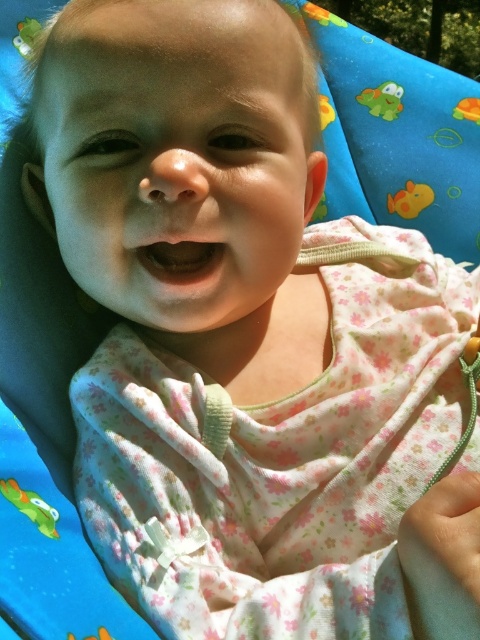
Which of these two, pink fabric mouth at center or yellow rubber duck at upper right, stands taller?

With more height is yellow rubber duck at upper right.

Can you confirm if pink fabric mouth at center is taller than yellow rubber duck at upper right?

No, pink fabric mouth at center is not taller than yellow rubber duck at upper right.

Is point (157, 275) in front of point (428, 200)?

Yes, it is in front of point (428, 200).

Locate an element on the screen. pink fabric mouth at center is located at coordinates (180, 259).

In the scene shown: Does green rubber turtle at upper center come in front of green plastic frog at upper left?

No, it is not.

Who is more distant from viewer, (396, 104) or (26, 33)?

The point (396, 104) is behind.

Who is more distant from viewer, [382,93] or [32,35]?

Positioned behind is point [382,93].

Find the location of a particular element. The height and width of the screenshot is (640, 480). green rubber turtle at upper center is located at coordinates (383, 99).

Find the location of `green rubber turtle at upper center`. green rubber turtle at upper center is located at coordinates (383, 99).

Is the position of green rubber turtle at upper center more distant than that of yellow rubber duck at upper right?

Yes, green rubber turtle at upper center is behind yellow rubber duck at upper right.

I want to click on green rubber turtle at upper center, so click(x=383, y=99).